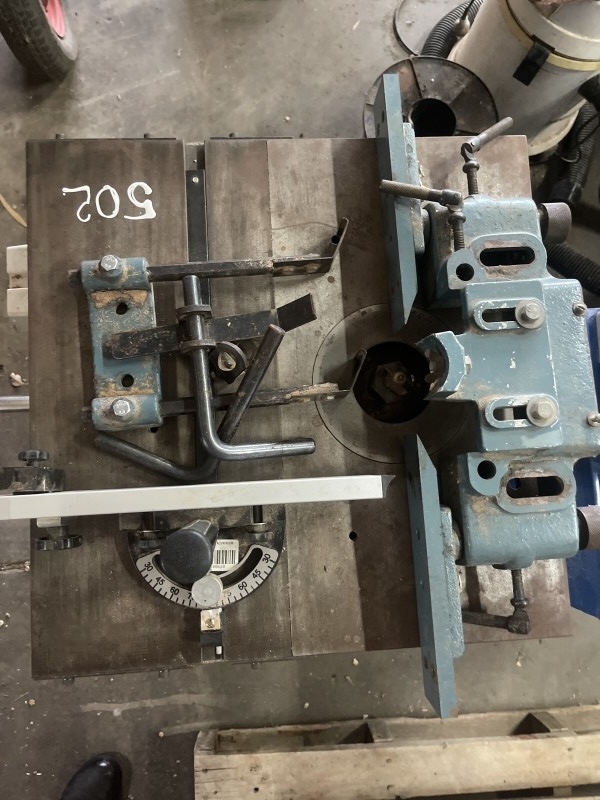
Image resolution: width=600 pixels, height=800 pixels. I want to click on white shop vacuum, so click(x=506, y=54).